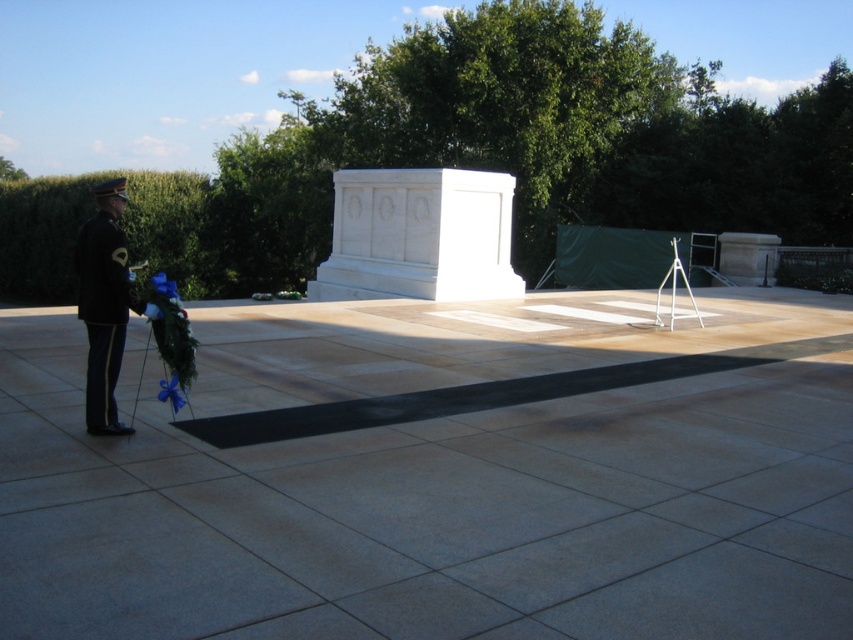
You are a photographer trying to capture a detailed shot of both the black uniform at left and the blue satin ribbon at lower left in the scene. Which object should you focus on first if you want to ensure both are in clear focus without adjusting your camera settings?

The black uniform at left has a larger size compared to the blue satin ribbon at lower left. To ensure both are in clear focus, you should focus on the larger object first, which is the black uniform at left, as it will have a greater depth of field requirement.

You are a photographer trying to capture a photo of the black uniform at left and the blue satin ribbon at lower left. Which object should you focus on first if you want to ensure both are in focus without adjusting the camera settings?

The black uniform at left is taller than the blue satin ribbon at lower left, so focusing on the black uniform at left first would help ensure both are in focus since it is larger in the frame.